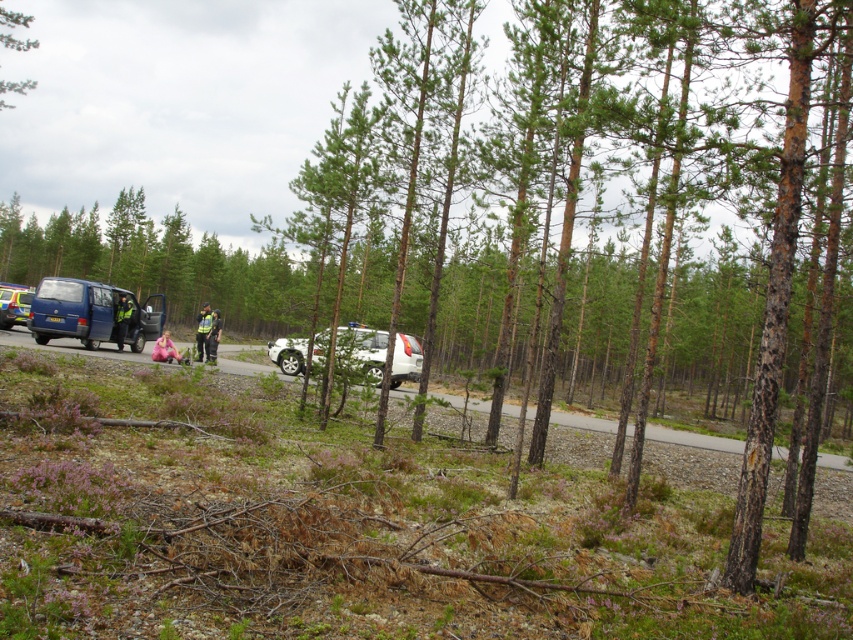
Which of these two, blue matte van at left or white matte suv at center, stands taller?

Standing taller between the two is blue matte van at left.

Which is in front, point (80, 305) or point (268, 346)?

Point (80, 305) is in front.

Locate an element on the screen. blue matte van at left is located at coordinates (91, 314).

Locate an element on the screen. blue matte van at left is located at coordinates (91, 314).

Identify the location of brown rough tree at center. The width and height of the screenshot is (853, 640). (619, 212).

Between point (509, 140) and point (32, 310), which one is positioned in front?

Point (509, 140) is in front.

Find the location of `brown rough tree at center`. brown rough tree at center is located at coordinates (619, 212).

In order to click on brown rough tree at center in this screenshot , I will do `click(619, 212)`.

Which is more to the right, reflective yellow vest at center or reflective silver helmet at center?

From the viewer's perspective, reflective silver helmet at center appears more on the right side.

Does reflective yellow vest at center appear over reflective silver helmet at center?

Indeed, reflective yellow vest at center is positioned over reflective silver helmet at center.

This screenshot has width=853, height=640. I want to click on reflective yellow vest at center, so click(x=202, y=332).

You are a GUI agent. You are given a task and a screenshot of the screen. Output one action in this format:
    pyautogui.click(x=<x>, y=<y>)
    Task: Click on the reflective yellow vest at center
    This screenshot has width=853, height=640.
    Given the screenshot: What is the action you would take?
    pyautogui.click(x=202, y=332)